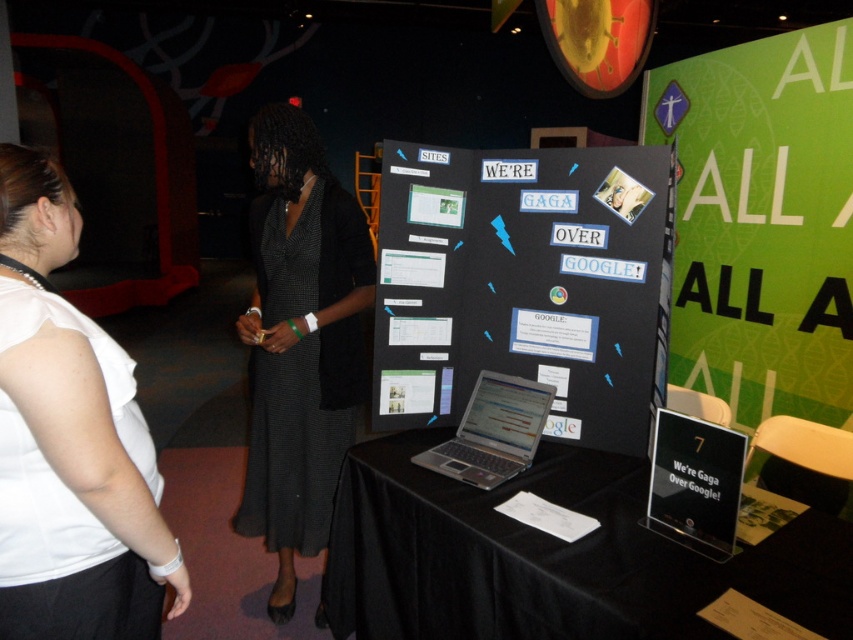
What do you see at coordinates (299, 340) in the screenshot?
I see `black textured dress at center` at bounding box center [299, 340].

The height and width of the screenshot is (640, 853). Describe the element at coordinates (299, 340) in the screenshot. I see `black textured dress at center` at that location.

Locate an element on the screen. The width and height of the screenshot is (853, 640). black textured dress at center is located at coordinates (299, 340).

The width and height of the screenshot is (853, 640). Describe the element at coordinates (549, 556) in the screenshot. I see `black clothed table at center` at that location.

Between point (416, 506) and point (482, 396), which one is positioned behind?

The point (482, 396) is behind.

Locate an element on the screen. black clothed table at center is located at coordinates (549, 556).

What do you see at coordinates (549, 556) in the screenshot?
I see `black clothed table at center` at bounding box center [549, 556].

Between point (410, 636) and point (244, 483), which one is positioned behind?

The point (244, 483) is behind.

Which is behind, point (376, 515) or point (310, 353)?

Point (310, 353)

You are a GUI agent. You are given a task and a screenshot of the screen. Output one action in this format:
    pyautogui.click(x=<x>, y=<y>)
    Task: Click on the black clothed table at center
    The height and width of the screenshot is (640, 853).
    Given the screenshot: What is the action you would take?
    pyautogui.click(x=549, y=556)